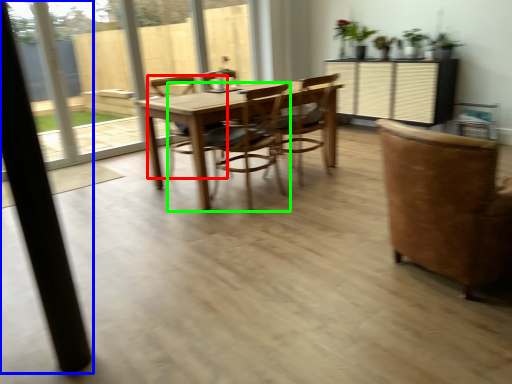
Question: Which is farther away from chair (highlighted by a red box)? pillar (highlighted by a blue box) or chair (highlighted by a green box)?

Choices:
 (A) pillar
 (B) chair

Answer: (A)